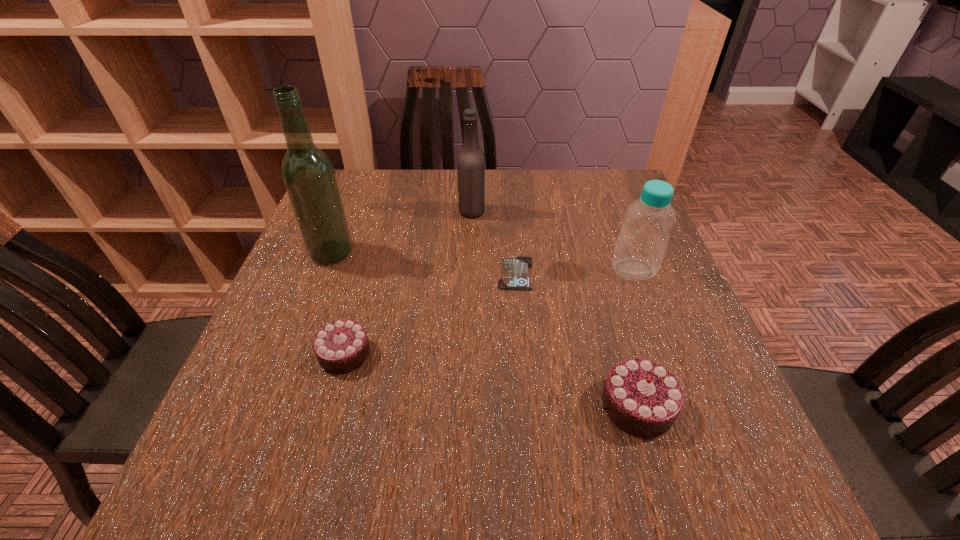
Image resolution: width=960 pixels, height=540 pixels. Find the location of `free space between the farther chocolate cake and the nearer chocolate cake`. free space between the farther chocolate cake and the nearer chocolate cake is located at coordinates (492, 380).

The image size is (960, 540). In order to click on vacant space that's between the identity card and the shorter chocolate cake in this screenshot , I will do `click(430, 313)`.

You are a GUI agent. You are given a task and a screenshot of the screen. Output one action in this format:
    pyautogui.click(x=<x>, y=<y>)
    Task: Click on the free space between the farthest object and the third tallest object
    The image size is (960, 540).
    Given the screenshot: What is the action you would take?
    [x=553, y=241]

Find the location of a particular element. unoccupied area between the tallest object and the shortest object is located at coordinates (423, 263).

Find the location of a particular element. The width and height of the screenshot is (960, 540). free space between the third object from right to left and the third object from left to right is located at coordinates 493,242.

At what (x,y) coordinates should I click in order to perform the action: click on empty location between the beer bottle and the shortest object. Please return your answer as a coordinate pair (x, y). The width and height of the screenshot is (960, 540). Looking at the image, I should click on (493, 242).

This screenshot has width=960, height=540. I want to click on empty location between the farthest object and the fourth shortest object, so click(x=553, y=241).

At what (x,y) coordinates should I click in order to perform the action: click on free area in between the farthest object and the second shortest object. Please return your answer as a coordinate pair (x, y). Image resolution: width=960 pixels, height=540 pixels. Looking at the image, I should click on (408, 282).

Locate an element on the screen. The image size is (960, 540). free space between the fourth tallest object and the fifth tallest object is located at coordinates (492, 380).

The image size is (960, 540). I want to click on free spot between the second tallest object and the bottle, so click(x=553, y=241).